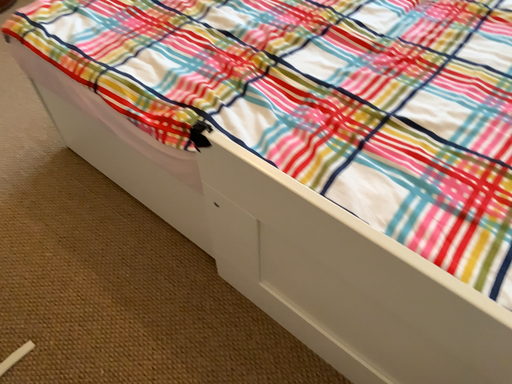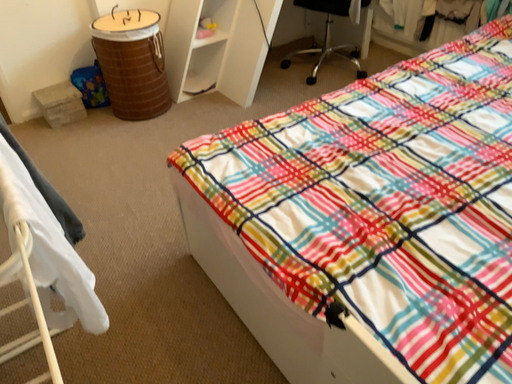
Question: Which way did the camera rotate in the video?

Choices:
 (A) rotated left
 (B) rotated right

Answer: (A)